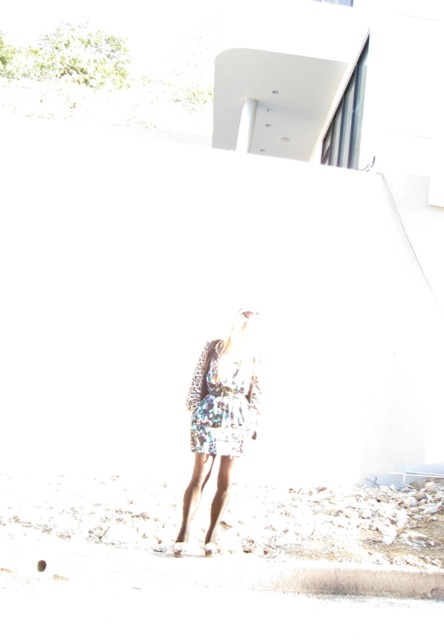
Is floral dress at center to the left of floral fabric dress at center from the viewer's perspective?

Correct, you'll find floral dress at center to the left of floral fabric dress at center.

Locate an element on the screen. floral dress at center is located at coordinates (221, 417).

You are a GUI agent. You are given a task and a screenshot of the screen. Output one action in this format:
    pyautogui.click(x=<x>, y=<y>)
    Task: Click on the floral dress at center
    The height and width of the screenshot is (640, 444).
    Given the screenshot: What is the action you would take?
    pyautogui.click(x=221, y=417)

In order to click on floral dress at center in this screenshot , I will do `click(221, 417)`.

What do you see at coordinates (337, 522) in the screenshot? I see `white sandy beach at lower center` at bounding box center [337, 522].

Which is behind, point (355, 556) or point (214, 403)?

Positioned behind is point (214, 403).

Does point (170, 538) lie in front of point (194, 371)?

That is True.

Locate an element on the screen. The image size is (444, 640). white sandy beach at lower center is located at coordinates (337, 522).

Is white sandy beach at lower center positioned before floral dress at center?

No, it is not.

Can you confirm if white sandy beach at lower center is wider than floral dress at center?

Yes, white sandy beach at lower center is wider than floral dress at center.

Is point (153, 512) farther from camera compared to point (210, 413)?

Yes.

Locate an element on the screen. The height and width of the screenshot is (640, 444). white sandy beach at lower center is located at coordinates (337, 522).